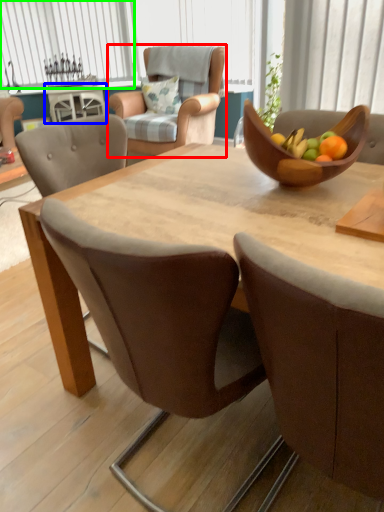
Question: Estimate the real-world distances between objects in this image. Which object is closer to chair (highlighted by a red box), coffee table (highlighted by a blue box) or window (highlighted by a green box)?

Choices:
 (A) coffee table
 (B) window

Answer: (A)